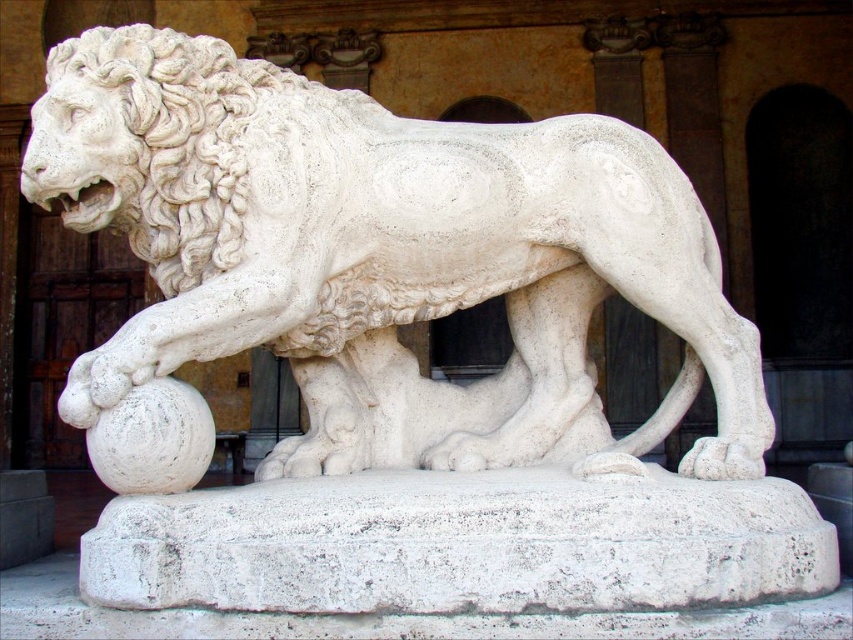
Question: Is white marble lion at center to the left of white marble paw at lower center from the viewer's perspective?

Choices:
 (A) no
 (B) yes

Answer: (B)

Question: Considering the relative positions of white stone paw at lower center and white marble paw at lower center in the image provided, where is white stone paw at lower center located with respect to white marble paw at lower center?

Choices:
 (A) above
 (B) below

Answer: (B)

Question: Which point is farther to the camera?

Choices:
 (A) (618, 468)
 (B) (691, 464)
 (C) (355, 428)

Answer: (C)

Question: Does white marble lion at center come behind white marble paw at lower center?

Choices:
 (A) yes
 (B) no

Answer: (B)

Question: Which object is the closest to the white marble paw at lower center?

Choices:
 (A) white marble lion at center
 (B) white stone paw at lower center

Answer: (B)

Question: Which of these objects is positioned closest to the white stone paw at lower center?

Choices:
 (A) white marble lion at center
 (B) white marble paw at lower center

Answer: (B)